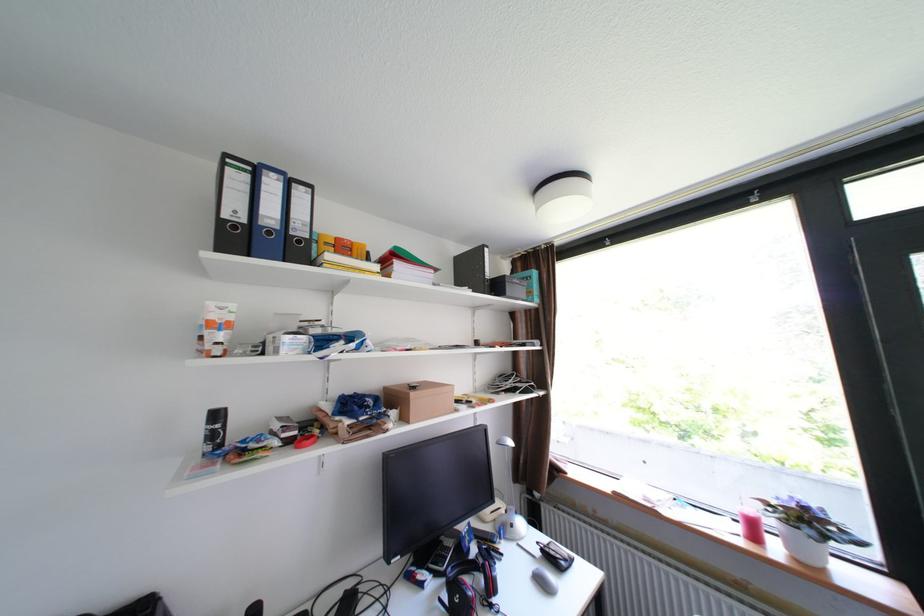
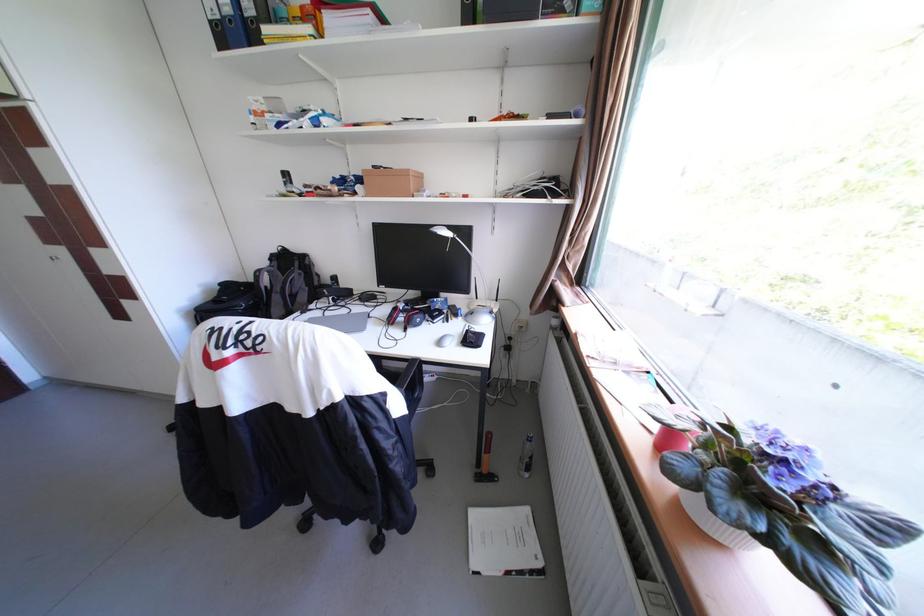
The point at (749, 530) is marked in the first image. Where is the corresponding point in the second image?

(666, 426)